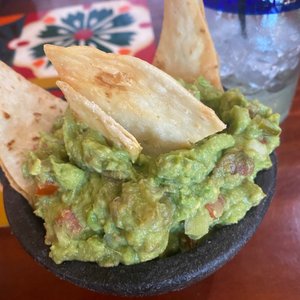
This screenshot has height=300, width=300. Find the location of `napkin`. napkin is located at coordinates (105, 26).